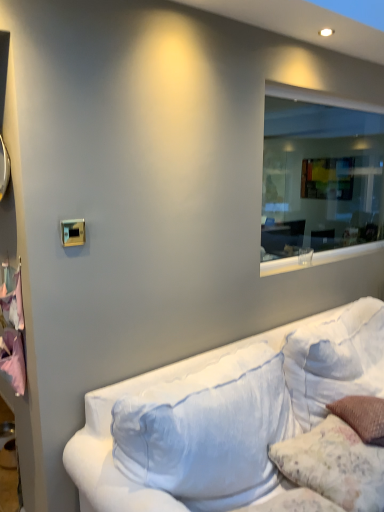
Identify the location of transparent glass window at upper right. The image size is (384, 512). (320, 179).

The width and height of the screenshot is (384, 512). What do you see at coordinates (13, 335) in the screenshot?
I see `pink fabric at left` at bounding box center [13, 335].

Locate an element on the screen. transparent glass window at upper right is located at coordinates (320, 179).

In terms of height, does fluffy white pillow at lower right look taller or shorter compared to pink fabric at left?

Considering their sizes, fluffy white pillow at lower right has less height than pink fabric at left.

From the image's perspective, would you say fluffy white pillow at lower right is shown under pink fabric at left?

Yes, from the image's perspective, fluffy white pillow at lower right is beneath pink fabric at left.

Would you say fluffy white pillow at lower right is a long distance from pink fabric at left?

Yes, fluffy white pillow at lower right and pink fabric at left are quite far apart.

Between fluffy white pillow at lower right and pink fabric at left, which one appears on the left side from the viewer's perspective?

pink fabric at left.

From a real-world perspective, is fluffy white pillow at lower right physically located above or below transparent glass window at upper right?

From a real-world perspective, fluffy white pillow at lower right is physically below transparent glass window at upper right.

Is fluffy white pillow at lower right not close to transparent glass window at upper right?

Yes, fluffy white pillow at lower right and transparent glass window at upper right are located far from each other.

Consider the image. From the image's perspective, would you say fluffy white pillow at lower right is positioned over transparent glass window at upper right?

Incorrect, from the image's perspective, fluffy white pillow at lower right is lower than transparent glass window at upper right.

Considering the sizes of objects pink fabric at left and transparent glass window at upper right in the image provided, who is smaller, pink fabric at left or transparent glass window at upper right?

With smaller size is pink fabric at left.

From the image's perspective, between pink fabric at left and transparent glass window at upper right, who is located below?

pink fabric at left is shown below in the image.

Are pink fabric at left and transparent glass window at upper right located far from each other?

Yes, pink fabric at left and transparent glass window at upper right are located far from each other.

Is transparent glass window at upper right placed right next to fluffy white pillow at lower right?

No.

Is transparent glass window at upper right positioned beyond the bounds of fluffy white pillow at lower right?

transparent glass window at upper right is positioned outside fluffy white pillow at lower right.

Is transparent glass window at upper right oriented towards fluffy white pillow at lower right?

No, transparent glass window at upper right is not aimed at fluffy white pillow at lower right.

From a real-world perspective, is transparent glass window at upper right physically located above or below fluffy white pillow at lower right?

In terms of real-world spatial position, transparent glass window at upper right is above fluffy white pillow at lower right.

Does transparent glass window at upper right appear on the left side of pink fabric at left?

No, transparent glass window at upper right is not to the left of pink fabric at left.

Locate an element on the screen. Image resolution: width=384 pixels, height=512 pixels. window that is on the right side of pink fabric at left is located at coordinates (320, 179).

From a real-world perspective, is transparent glass window at upper right on top of pink fabric at left?

Yes, from a real-world perspective, transparent glass window at upper right is on top of pink fabric at left.

Considering the relative sizes of transparent glass window at upper right and pink fabric at left in the image provided, is transparent glass window at upper right wider than pink fabric at left?

No, transparent glass window at upper right is not wider than pink fabric at left.

Considering the sizes of transparent glass window at upper right and white fabric couch at lower right in the image, is transparent glass window at upper right wider or thinner than white fabric couch at lower right?

Considering their sizes, transparent glass window at upper right looks slimmer than white fabric couch at lower right.

From a real-world perspective, which object rests below the other?

From a 3D spatial view, white fabric couch at lower right is below.

This screenshot has width=384, height=512. I want to click on studio couch in front of the transparent glass window at upper right, so click(x=222, y=415).

Which is more to the left, transparent glass window at upper right or white fabric couch at lower right?

Positioned to the left is white fabric couch at lower right.

Between white fabric couch at lower right and fluffy white pillow at lower right, which one has smaller width?

fluffy white pillow at lower right is thinner.

How different are the orientations of white fabric couch at lower right and fluffy white pillow at lower right in degrees?

The facing directions of white fabric couch at lower right and fluffy white pillow at lower right are 3.37 degrees apart.

Is white fabric couch at lower right taller than fluffy white pillow at lower right?

Yes, white fabric couch at lower right is taller than fluffy white pillow at lower right.

Are white fabric couch at lower right and fluffy white pillow at lower right far apart?

No, white fabric couch at lower right is not far away from fluffy white pillow at lower right.

In the image, there is a pink fabric at left. Identify the location of pillow below it (from the image's perspective). (334, 465).

Where is `pillow in front of the transparent glass window at upper right`? The image size is (384, 512). pillow in front of the transparent glass window at upper right is located at coordinates (334, 465).

From the image, which object appears to be farther from transparent glass window at upper right, white fabric couch at lower right or pink fabric at left?

The object further to transparent glass window at upper right is pink fabric at left.

Considering their positions, is fluffy white pillow at lower right positioned further to transparent glass window at upper right than white fabric couch at lower right?

fluffy white pillow at lower right lies further to transparent glass window at upper right than the other object.

From the image, which object appears to be nearer to transparent glass window at upper right, pink fabric at left or white fabric couch at lower right?

Based on the image, white fabric couch at lower right appears to be nearer to transparent glass window at upper right.

Considering their positions, is transparent glass window at upper right positioned closer to fluffy white pillow at lower right than white fabric couch at lower right?

white fabric couch at lower right lies closer to fluffy white pillow at lower right than the other object.

When comparing their distances from fluffy white pillow at lower right, does pink fabric at left or white fabric couch at lower right seem closer?

white fabric couch at lower right is positioned closer to the anchor fluffy white pillow at lower right.

From the image, which object appears to be nearer to transparent glass window at upper right, pink fabric at left or fluffy white pillow at lower right?

The object closer to transparent glass window at upper right is fluffy white pillow at lower right.

Looking at the image, which one is located further to fluffy white pillow at lower right, transparent glass window at upper right or pink fabric at left?

The object further to fluffy white pillow at lower right is transparent glass window at upper right.

Looking at the image, which one is located further to fluffy white pillow at lower right, pink fabric at left or transparent glass window at upper right?

transparent glass window at upper right is positioned further to the anchor fluffy white pillow at lower right.

Identify the location of pillow situated between pink fabric at left and transparent glass window at upper right from left to right. (334, 465).

At what (x,y) coordinates should I click in order to perform the action: click on studio couch between pink fabric at left and transparent glass window at upper right in the horizontal direction. Please return your answer as a coordinate pair (x, y). Looking at the image, I should click on (222, 415).

In order to click on pillow between pink fabric at left and white fabric couch at lower right from left to right in this screenshot , I will do `click(334, 465)`.

Where is `pillow between transparent glass window at upper right and white fabric couch at lower right in the up-down direction`? pillow between transparent glass window at upper right and white fabric couch at lower right in the up-down direction is located at coordinates (334, 465).